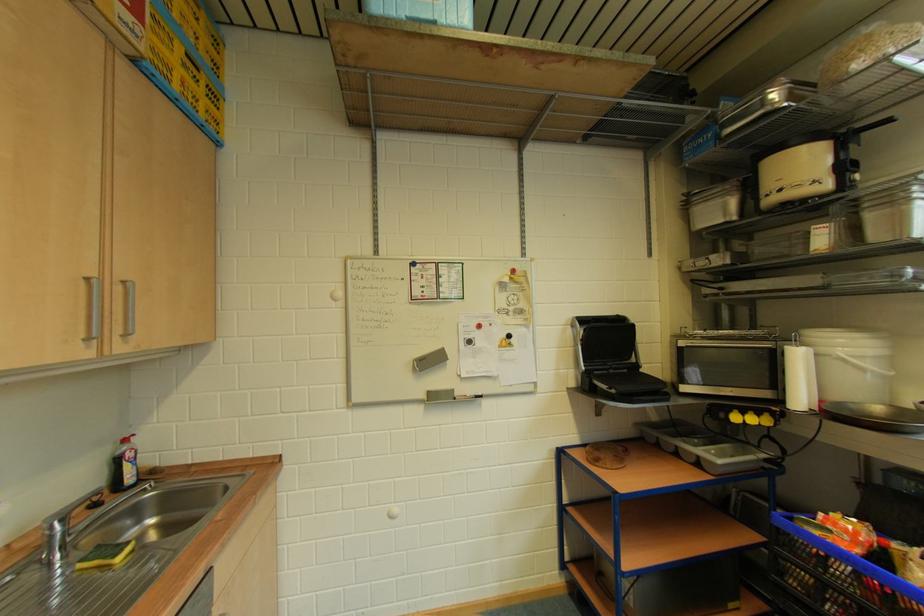
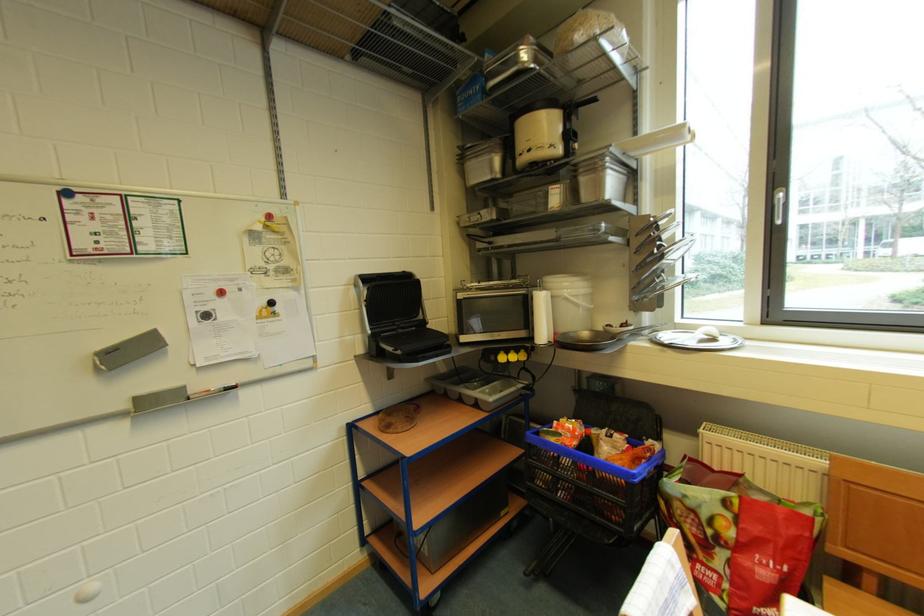
Question: Based on the continuous images, in which direction is the camera rotating? Reply with the corresponding letter.

Choices:
 (A) Left
 (B) Right
 (C) Up
 (D) Down

Answer: (B)